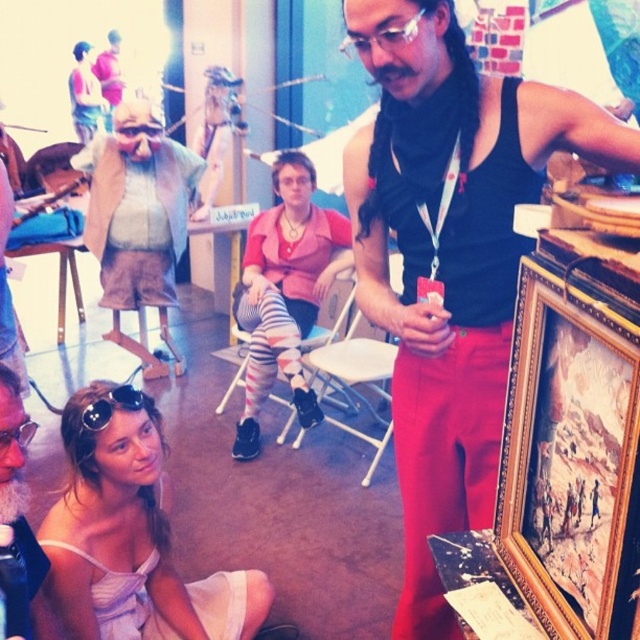
Question: Which object appears farthest from the camera in this image?

Choices:
 (A) sunglasses at lower left
 (B) pink fabric shirt at center
 (C) black tank top at upper right

Answer: (B)

Question: Where is matte pink shirt at upper left located in relation to matte black goggles at upper left in the image?

Choices:
 (A) right
 (B) left

Answer: (B)

Question: Can you confirm if bearded man with glasses at lower left is positioned above matte pink shirt at upper left?

Choices:
 (A) yes
 (B) no

Answer: (B)

Question: Which object is the farthest from the matte pink shirt at upper left?

Choices:
 (A) matte black goggles at upper left
 (B) goldwooden frame at right
 (C) pink fabric shirt at center
 (D) sunglasses at lower left

Answer: (B)

Question: Which point is closer to the camera taking this photo?

Choices:
 (A) (17, 445)
 (B) (461, 49)
 (C) (81, 92)

Answer: (A)

Question: Does pink fabric shirt at center appear on the left side of sunglasses at lower left?

Choices:
 (A) yes
 (B) no

Answer: (B)